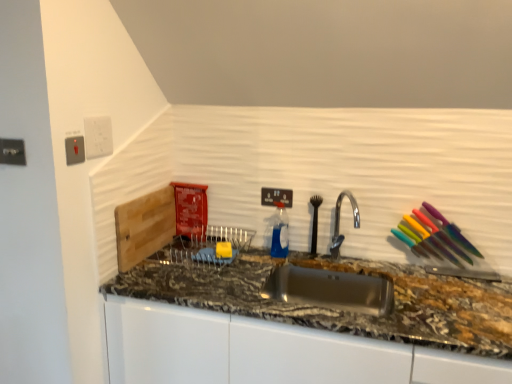
In order to face silver metallic faucet at center, should I rotate leftwards or rightwards?

You should look right and rotate roughly 11.221 degrees.

What do you see at coordinates (276, 197) in the screenshot? I see `black plastic electric outlet at upper center, which appears as the fourth electric outlet when viewed from the front` at bounding box center [276, 197].

Find the location of a particular element. The image size is (512, 384). granite at center is located at coordinates (337, 310).

In order to face metallic silver outlet at upper left, the fourth electric outlet positioned from the right, should I rotate leftwards or rightwards?

You should look left and rotate roughly 29.806 degrees.

Find the location of a particular element. This screenshot has height=384, width=512. metallic silver outlet at upper left, the fourth electric outlet positioned from the right is located at coordinates (12, 152).

Where is `satin silver switch at upper left, placed as the third electric outlet when sorted from right to left`? Image resolution: width=512 pixels, height=384 pixels. satin silver switch at upper left, placed as the third electric outlet when sorted from right to left is located at coordinates (74, 150).

Considering the relative positions of satin silver switch at upper left, acting as the third electric outlet starting from the back, and metallic silver outlet at upper left, the first electric outlet from the left, in the image provided, is satin silver switch at upper left, acting as the third electric outlet starting from the back, to the left of metallic silver outlet at upper left, the first electric outlet from the left, from the viewer's perspective?

No.

Is metallic silver outlet at upper left, the fourth electric outlet positioned from the right, surrounded by satin silver switch at upper left, placed as the third electric outlet when sorted from right to left?

No.

At what (x,y) coordinates should I click in order to perform the action: click on electric outlet that is the 1st one when counting upward from the metallic silver outlet at upper left, the first electric outlet from the left (from the image's perspective). Please return your answer as a coordinate pair (x, y). Looking at the image, I should click on (74, 150).

Considering the relative sizes of satin silver switch at upper left, the 2th electric outlet from the front, and metallic silver outlet at upper left, the fourth electric outlet positioned from the right, in the image provided, is satin silver switch at upper left, the 2th electric outlet from the front, shorter than metallic silver outlet at upper left, the fourth electric outlet positioned from the right,?

Incorrect, the height of satin silver switch at upper left, the 2th electric outlet from the front, does not fall short of that of metallic silver outlet at upper left, the fourth electric outlet positioned from the right.

From the image's perspective, which is above, white plastic electric outlet at upper left, which is the 3th electric outlet in left-to-right order, or granite at center?

white plastic electric outlet at upper left, which is the 3th electric outlet in left-to-right order, appears higher in the image.

Which object is more forward, white plastic electric outlet at upper left, the 3th electric outlet when ordered from front to back, or granite at center?

granite at center.

Can you tell me how much white plastic electric outlet at upper left, placed as the 2th electric outlet when sorted from right to left, and granite at center differ in facing direction?

They differ by 90.2 degrees in their facing directions.

From the picture: Between white plastic electric outlet at upper left, the 3th electric outlet when ordered from front to back, and granite at center, which one has less height?

With less height is white plastic electric outlet at upper left, the 3th electric outlet when ordered from front to back.

Can you tell me how much white plastic electric outlet at upper left, which is the 3th electric outlet in left-to-right order, and black plastic electric outlet at upper center, positioned as the fourth electric outlet in left-to-right order, differ in facing direction?

The angle between the facing direction of white plastic electric outlet at upper left, which is the 3th electric outlet in left-to-right order, and the facing direction of black plastic electric outlet at upper center, positioned as the fourth electric outlet in left-to-right order, is 89.9 degrees.

I want to click on the 3rd electric outlet below the white plastic electric outlet at upper left, which is the 3th electric outlet in left-to-right order (from the image's perspective), so click(x=276, y=197).

How far apart are white plastic electric outlet at upper left, marked as the 2th electric outlet in a back-to-front arrangement, and black plastic electric outlet at upper center, positioned as the fourth electric outlet in left-to-right order?

29.79 inches.

Consider the image. Is white plastic electric outlet at upper left, which is the 3th electric outlet in left-to-right order, positioned before black plastic electric outlet at upper center, arranged as the first electric outlet when viewed from the right?

Yes, white plastic electric outlet at upper left, which is the 3th electric outlet in left-to-right order, is closer to the camera.

Which point is more distant from viewer, (9, 154) or (72, 142)?

The point (72, 142) is farther.

From a real-world perspective, between metallic silver outlet at upper left, the first electric outlet positioned from the front, and satin silver switch at upper left, placed as the third electric outlet when sorted from right to left, who is vertically higher?

metallic silver outlet at upper left, the first electric outlet positioned from the front, from a real-world perspective.

Can you tell me how much metallic silver outlet at upper left, which is the 4th electric outlet from back to front, and satin silver switch at upper left, the 2th electric outlet from the front, differ in facing direction?

The facing directions of metallic silver outlet at upper left, which is the 4th electric outlet from back to front, and satin silver switch at upper left, the 2th electric outlet from the front, are 89.3 degrees apart.

Is metallic silver outlet at upper left, the first electric outlet from the left, located outside satin silver switch at upper left, acting as the third electric outlet starting from the back?

Yes, metallic silver outlet at upper left, the first electric outlet from the left, is not within satin silver switch at upper left, acting as the third electric outlet starting from the back.

Considering the relative sizes of black plastic electric outlet at upper center, which appears as the first electric outlet when viewed from the back, and metallic silver outlet at upper left, the fourth electric outlet positioned from the right, in the image provided, is black plastic electric outlet at upper center, which appears as the first electric outlet when viewed from the back, shorter than metallic silver outlet at upper left, the fourth electric outlet positioned from the right,?

Yes.

Consider the image. Is black plastic electric outlet at upper center, which appears as the fourth electric outlet when viewed from the front, surrounding metallic silver outlet at upper left, the first electric outlet from the left?

Actually, metallic silver outlet at upper left, the first electric outlet from the left, is outside black plastic electric outlet at upper center, which appears as the fourth electric outlet when viewed from the front.

Considering the positions of objects black plastic electric outlet at upper center, which appears as the first electric outlet when viewed from the back, and metallic silver outlet at upper left, the fourth electric outlet positioned from the right, in the image provided, who is more to the left, black plastic electric outlet at upper center, which appears as the first electric outlet when viewed from the back, or metallic silver outlet at upper left, the fourth electric outlet positioned from the right,?

From the viewer's perspective, metallic silver outlet at upper left, the fourth electric outlet positioned from the right, appears more on the left side.

Find the location of a particular element. electric outlet that is the 3rd object to the right of the metallic silver outlet at upper left, the fourth electric outlet positioned from the right, starting at the anchor is located at coordinates (276, 197).

Is satin silver switch at upper left, placed as the third electric outlet when sorted from right to left, positioned behind black plastic electric outlet at upper center, arranged as the first electric outlet when viewed from the right?

No, satin silver switch at upper left, placed as the third electric outlet when sorted from right to left, is in front of black plastic electric outlet at upper center, arranged as the first electric outlet when viewed from the right.

Measure the distance from satin silver switch at upper left, acting as the third electric outlet starting from the back, to black plastic electric outlet at upper center, positioned as the fourth electric outlet in left-to-right order.

satin silver switch at upper left, acting as the third electric outlet starting from the back, and black plastic electric outlet at upper center, positioned as the fourth electric outlet in left-to-right order, are 33.09 inches apart.

In the scene shown: Choose the correct answer: Is satin silver switch at upper left, acting as the third electric outlet starting from the back, inside black plastic electric outlet at upper center, which appears as the fourth electric outlet when viewed from the front, or outside it?

satin silver switch at upper left, acting as the third electric outlet starting from the back, exists outside the volume of black plastic electric outlet at upper center, which appears as the fourth electric outlet when viewed from the front.

Which is more distant, [77,162] or [270,194]?

The point [270,194] is behind.

From the image's perspective, relative to metallic silver outlet at upper left, the fourth electric outlet positioned from the right, is granite at center above or below?

Clearly, from the image's perspective, granite at center is below metallic silver outlet at upper left, the fourth electric outlet positioned from the right.

Does granite at center have a greater height compared to metallic silver outlet at upper left, the fourth electric outlet positioned from the right?

Yes.

Is the depth of granite at center less than that of metallic silver outlet at upper left, the first electric outlet from the left?

Yes.

How many degrees apart are the facing directions of granite at center and metallic silver outlet at upper left, the first electric outlet from the left?

They differ by 0.592 degrees in their facing directions.

Find the location of a particular element. The image size is (512, 384). the 1st electric outlet to the right of the metallic silver outlet at upper left, which is the 4th electric outlet from back to front, counting from the anchor's position is located at coordinates (74, 150).

Where is `the 2nd electric outlet counting from the left of the granite at center`? This screenshot has height=384, width=512. the 2nd electric outlet counting from the left of the granite at center is located at coordinates (98, 137).

When comparing their distances from silver metallic faucet at center, does metallic silver outlet at upper left, the fourth electric outlet positioned from the right, or white plastic electric outlet at upper left, marked as the 2th electric outlet in a back-to-front arrangement, seem further?

metallic silver outlet at upper left, the fourth electric outlet positioned from the right, is positioned further to the anchor silver metallic faucet at center.

Considering their positions, is satin silver switch at upper left, placed as the third electric outlet when sorted from right to left, positioned further to metallic silver outlet at upper left, the first electric outlet from the left, than granite at center?

granite at center is positioned further to the anchor metallic silver outlet at upper left, the first electric outlet from the left.

When comparing their distances from metallic silver outlet at upper left, the first electric outlet from the left, does silver metallic faucet at center or satin silver switch at upper left, acting as the third electric outlet starting from the back, seem closer?

satin silver switch at upper left, acting as the third electric outlet starting from the back, lies closer to metallic silver outlet at upper left, the first electric outlet from the left, than the other object.

Looking at the image, which one is located further to white plastic electric outlet at upper left, placed as the 2th electric outlet when sorted from right to left, satin silver switch at upper left, acting as the third electric outlet starting from the back, or black plastic electric outlet at upper center, which appears as the fourth electric outlet when viewed from the front?

Among the two, black plastic electric outlet at upper center, which appears as the fourth electric outlet when viewed from the front, is located further to white plastic electric outlet at upper left, placed as the 2th electric outlet when sorted from right to left.

Looking at the image, which one is located closer to granite at center, white plastic electric outlet at upper left, the 3th electric outlet when ordered from front to back, or silver metallic faucet at center?

The object closer to granite at center is silver metallic faucet at center.

When comparing their distances from granite at center, does metallic silver outlet at upper left, the fourth electric outlet positioned from the right, or silver metallic faucet at center seem closer?

Among the two, silver metallic faucet at center is located nearer to granite at center.

Estimate the real-world distances between objects in this image. Which object is further from white plastic electric outlet at upper left, the 3th electric outlet when ordered from front to back, granite at center or silver metallic faucet at center?

silver metallic faucet at center is further to white plastic electric outlet at upper left, the 3th electric outlet when ordered from front to back.

Looking at the image, which one is located closer to silver metallic faucet at center, satin silver switch at upper left, the 2th electric outlet when ordered from left to right, or metallic silver outlet at upper left, the first electric outlet positioned from the front?

Based on the image, satin silver switch at upper left, the 2th electric outlet when ordered from left to right, appears to be nearer to silver metallic faucet at center.

Find the location of `electric outlet situated between satin silver switch at upper left, the 2th electric outlet when ordered from left to right, and black plastic electric outlet at upper center, which appears as the fourth electric outlet when viewed from the front, from left to right`. electric outlet situated between satin silver switch at upper left, the 2th electric outlet when ordered from left to right, and black plastic electric outlet at upper center, which appears as the fourth electric outlet when viewed from the front, from left to right is located at coordinates (98, 137).

Locate an element on the screen. The image size is (512, 384). countertop between white plastic electric outlet at upper left, the 3th electric outlet when ordered from front to back, and silver metallic faucet at center, in the horizontal direction is located at coordinates (337, 310).

Find the location of a particular element. The image size is (512, 384). electric outlet situated between white plastic electric outlet at upper left, marked as the 2th electric outlet in a back-to-front arrangement, and silver metallic faucet at center from left to right is located at coordinates (276, 197).

At what (x,y) coordinates should I click in order to perform the action: click on countertop located between metallic silver outlet at upper left, which is the 4th electric outlet from back to front, and silver metallic faucet at center in the left-right direction. Please return your answer as a coordinate pair (x, y). The width and height of the screenshot is (512, 384). Looking at the image, I should click on (337, 310).